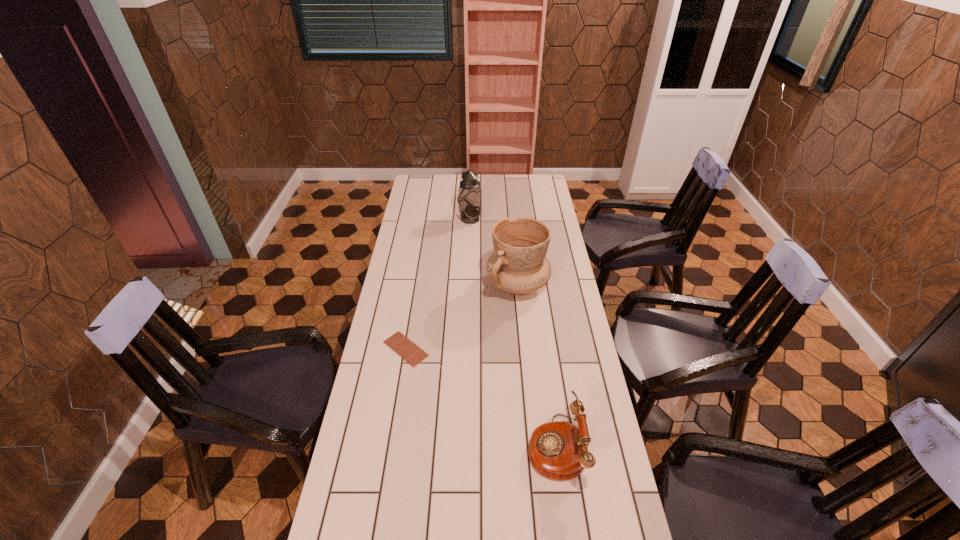
Where is `vacant area between the pottery and the telephone`? The image size is (960, 540). vacant area between the pottery and the telephone is located at coordinates (537, 366).

Locate which object is the third closest to the nearest object. Please provide its 2D coordinates. Your answer should be formatted as a tuple, i.e. [(x, y)], where the tuple contains the x and y coordinates of a point satisfying the conditions above.

[(469, 199)]

Point out which object is positioned as the third nearest to the nearest object. Please provide its 2D coordinates. Your answer should be formatted as a tuple, i.e. [(x, y)], where the tuple contains the x and y coordinates of a point satisfying the conditions above.

[(469, 199)]

Where is `free space that satisfies the following two spatial constraints: 1. on the front side of the second tallest object; 2. on the left side of the third object from right to left`? This screenshot has width=960, height=540. free space that satisfies the following two spatial constraints: 1. on the front side of the second tallest object; 2. on the left side of the third object from right to left is located at coordinates (468, 285).